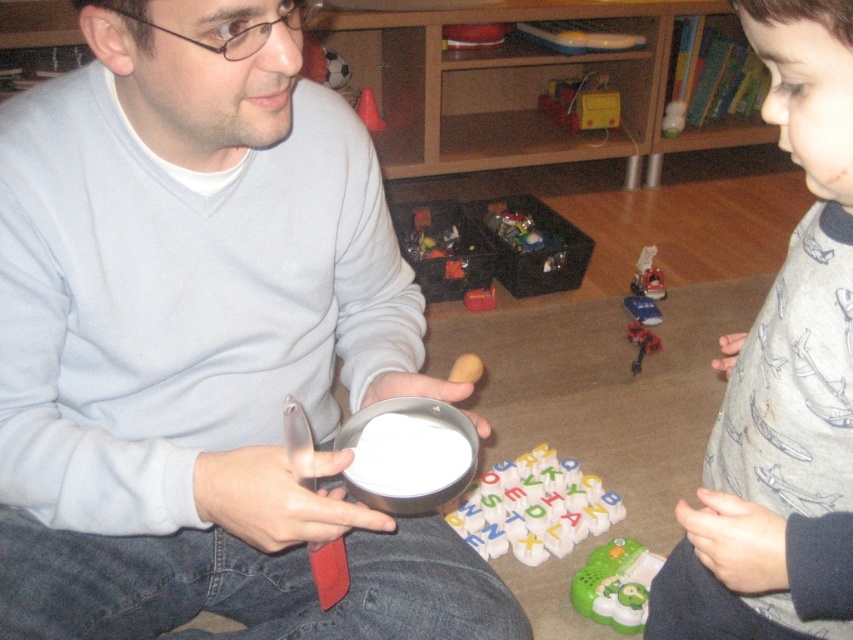
Question: Which object is farther from the camera taking this photo?

Choices:
 (A) wooden alphabet blocks at center
 (B) metallic red toy car at center

Answer: (B)

Question: Is metallic red toy car at center thinner than metallic plastic toy car at center?

Choices:
 (A) yes
 (B) no

Answer: (B)

Question: Among these points, which one is farthest from the camera?

Choices:
 (A) (650, 580)
 (B) (444, 497)

Answer: (A)

Question: Is gray cotton pajamas at right further to the viewer compared to rubberized plastic toy car at center?

Choices:
 (A) yes
 (B) no

Answer: (B)

Question: Can you confirm if wooden alphabet blocks at center is positioned to the right of green plastic toy at lower right?

Choices:
 (A) yes
 (B) no

Answer: (B)

Question: Which of the following is the closest to the observer?

Choices:
 (A) gray cotton pajamas at right
 (B) wooden alphabet blocks at center

Answer: (A)